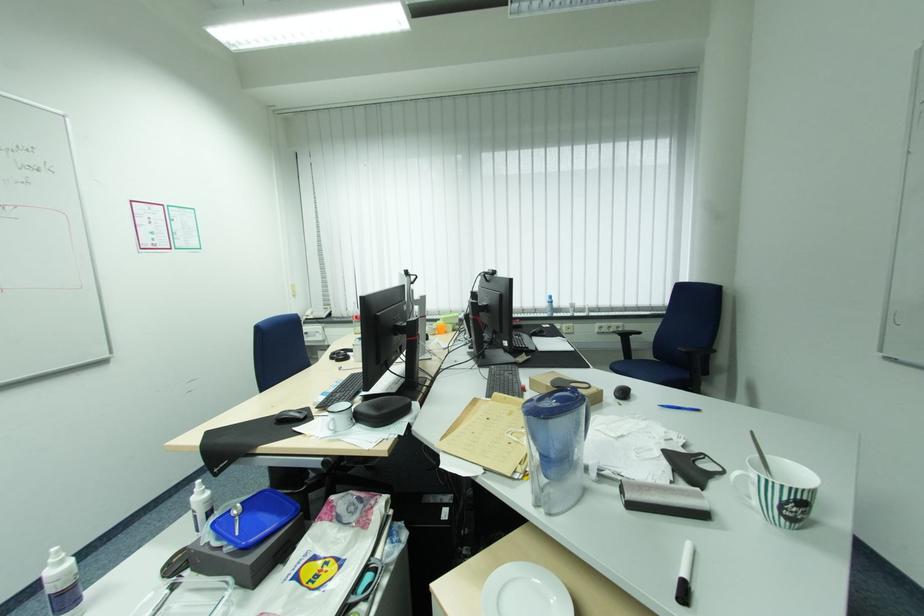
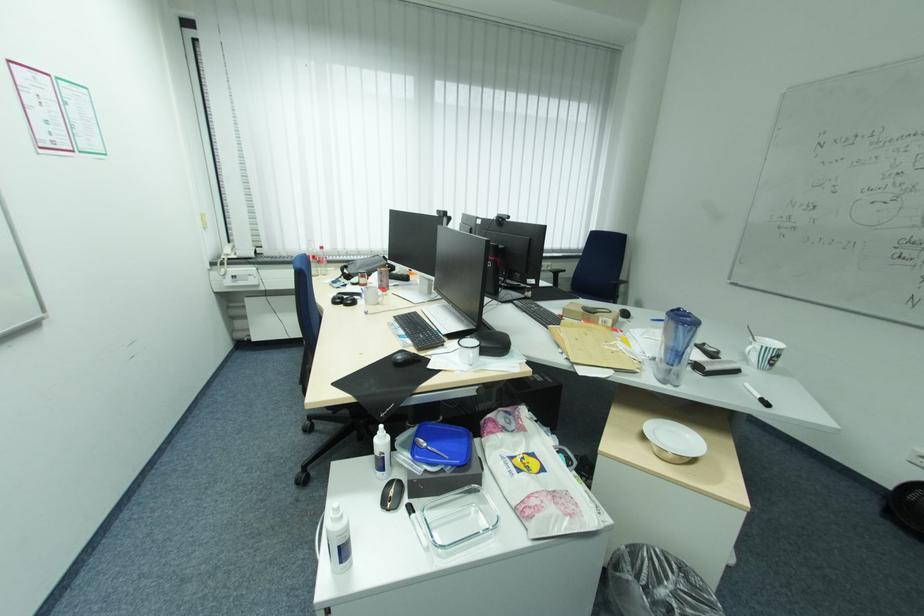
Where in the second image is the point corresponding to pixel 286 418 from the first image?

(406, 361)